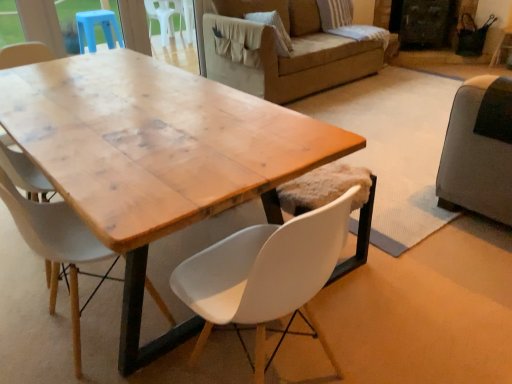
Question: Is white matte chair at center, the first chair when ordered from left to right, beside striped fabric pillow at upper right?

Choices:
 (A) no
 (B) yes

Answer: (A)

Question: Can you confirm if white matte chair at center, the first chair when ordered from left to right, is shorter than striped fabric pillow at upper right?

Choices:
 (A) no
 (B) yes

Answer: (A)

Question: Is white matte chair at center, the first chair when ordered from left to right, bigger than striped fabric pillow at upper right?

Choices:
 (A) no
 (B) yes

Answer: (B)

Question: Is white matte chair at center, the 2th chair viewed from the right, to the right of striped fabric pillow at upper right from the viewer's perspective?

Choices:
 (A) no
 (B) yes

Answer: (A)

Question: From the image's perspective, is white matte chair at center, the first chair when ordered from left to right, under striped fabric pillow at upper right?

Choices:
 (A) no
 (B) yes

Answer: (B)

Question: From the image's perspective, is striped fabric pillow at upper right located above or below black matte screen door at upper right?

Choices:
 (A) above
 (B) below

Answer: (B)

Question: Is striped fabric pillow at upper right wider or thinner than black matte screen door at upper right?

Choices:
 (A) wide
 (B) thin

Answer: (B)

Question: Relative to black matte screen door at upper right, is striped fabric pillow at upper right in front or behind?

Choices:
 (A) front
 (B) behind

Answer: (A)

Question: Looking at the image, does striped fabric pillow at upper right seem bigger or smaller compared to black matte screen door at upper right?

Choices:
 (A) small
 (B) big

Answer: (A)

Question: From the image's perspective, is white matte chair at center, the 2th chair viewed from the right, positioned above or below dark gray fabric couch at right?

Choices:
 (A) below
 (B) above

Answer: (A)

Question: Is point (44, 218) closer or farther from the camera than point (504, 205)?

Choices:
 (A) farther
 (B) closer

Answer: (B)

Question: In terms of height, does white matte chair at center, the 2th chair viewed from the right, look taller or shorter compared to dark gray fabric couch at right?

Choices:
 (A) tall
 (B) short

Answer: (A)

Question: Based on their positions, is white matte chair at center, the 2th chair viewed from the right, located to the left or right of dark gray fabric couch at right?

Choices:
 (A) left
 (B) right

Answer: (A)

Question: In terms of width, does white plastic chair at center, which appears as the second chair when viewed from the left, look wider or thinner when compared to striped fabric pillow at upper right?

Choices:
 (A) thin
 (B) wide

Answer: (A)

Question: Would you say white plastic chair at center, which appears as the second chair when viewed from the left, is inside or outside striped fabric pillow at upper right?

Choices:
 (A) inside
 (B) outside

Answer: (B)